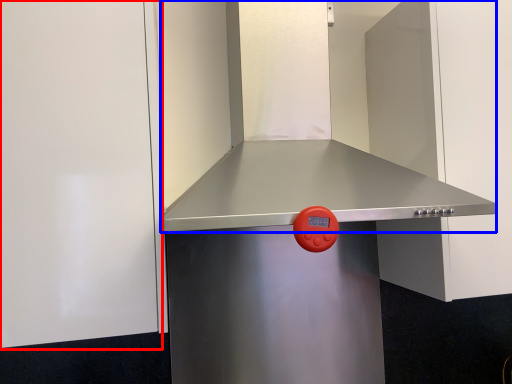
Question: Which of the following is the closest to the observer, door (highlighted by a red box) or vent (highlighted by a blue box)?

Choices:
 (A) door
 (B) vent

Answer: (B)